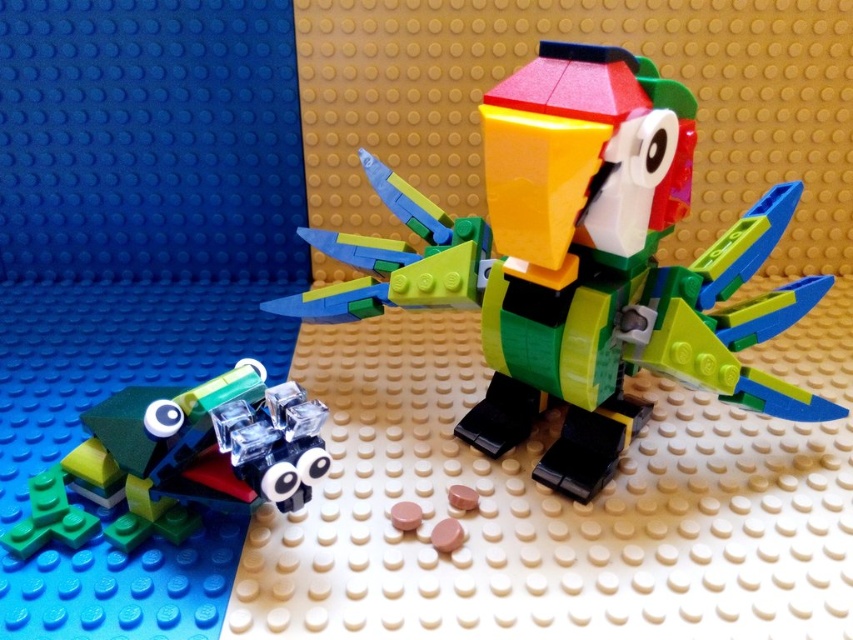
Question: Among these points, which one is nearest to the camera?

Choices:
 (A) (151, 518)
 (B) (578, 186)

Answer: (B)

Question: In this image, where is multicolored plastic parrot at center located relative to translucent green plastic frog at lower left?

Choices:
 (A) left
 (B) right

Answer: (B)

Question: Does multicolored plastic parrot at center appear on the right side of translucent green plastic frog at lower left?

Choices:
 (A) yes
 (B) no

Answer: (A)

Question: Does multicolored plastic parrot at center have a larger size compared to translucent green plastic frog at lower left?

Choices:
 (A) no
 (B) yes

Answer: (B)

Question: Which point appears farthest from the camera in this image?

Choices:
 (A) (648, 68)
 (B) (138, 518)

Answer: (B)